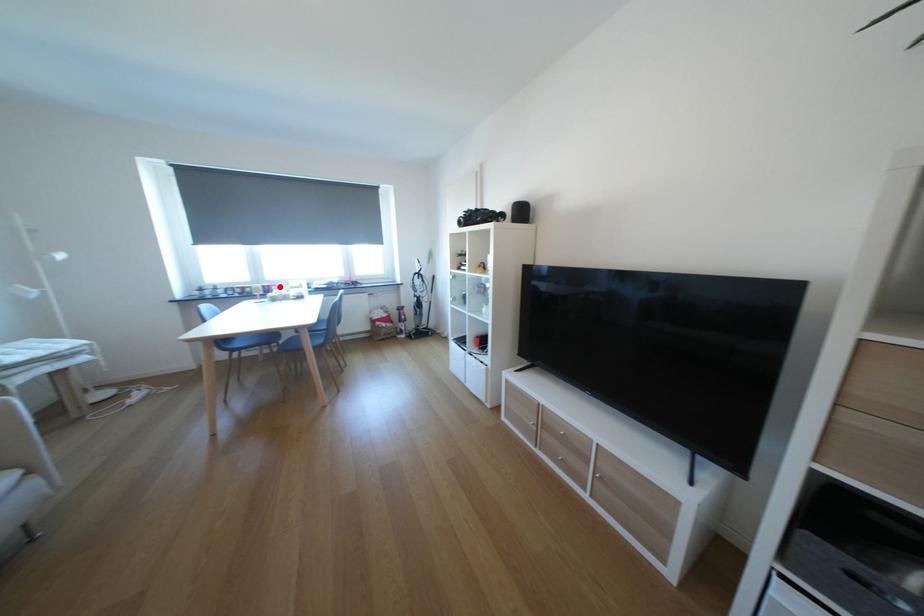
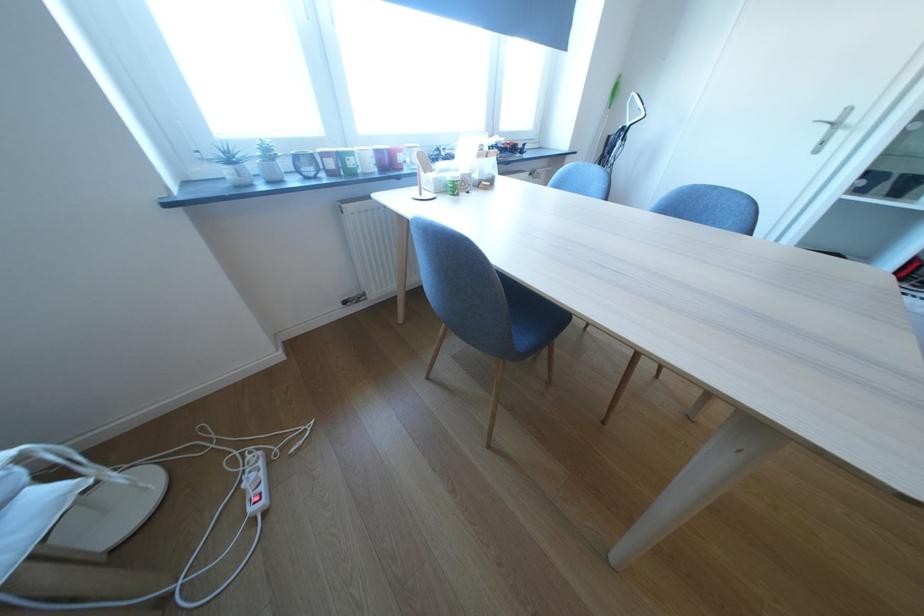
Locate, in the second image, the point that corresponds to the highlighted location in the first image.

(399, 151)